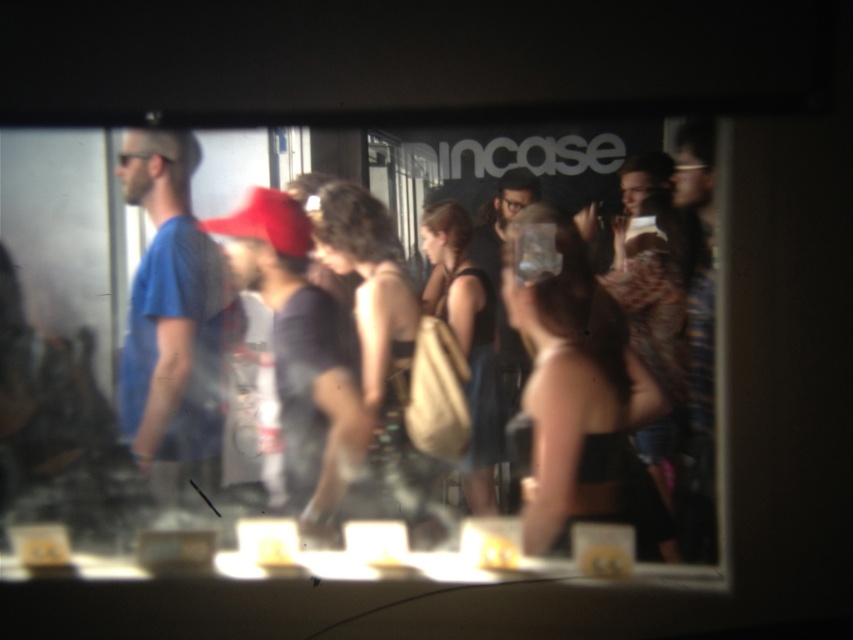
You are a GUI agent. You are given a task and a screenshot of the screen. Output one action in this format:
    pyautogui.click(x=<x>, y=<y>)
    Task: Click on the transparent glass at center
    This screenshot has width=853, height=640.
    Given the screenshot: What is the action you would take?
    pyautogui.click(x=335, y=316)

Can you confirm if transparent glass at center is smaller than blue cotton t-shirt at center?

Actually, transparent glass at center might be larger than blue cotton t-shirt at center.

You are a GUI agent. You are given a task and a screenshot of the screen. Output one action in this format:
    pyautogui.click(x=<x>, y=<y>)
    Task: Click on the transparent glass at center
    The height and width of the screenshot is (640, 853).
    Given the screenshot: What is the action you would take?
    pyautogui.click(x=335, y=316)

Image resolution: width=853 pixels, height=640 pixels. In order to click on transparent glass at center in this screenshot , I will do `click(335, 316)`.